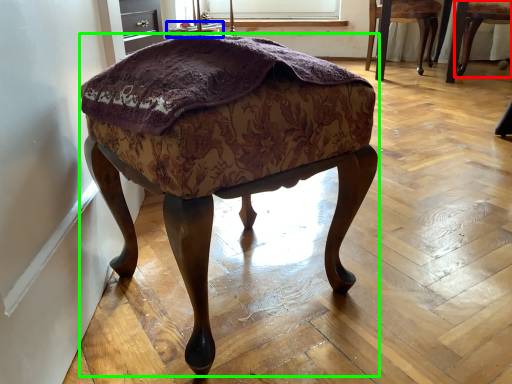
Question: Based on their relative distances, which object is farther from chair (highlighted by a red box)? Choose from side table (highlighted by a blue box) and stool (highlighted by a green box).

Choices:
 (A) side table
 (B) stool

Answer: (B)